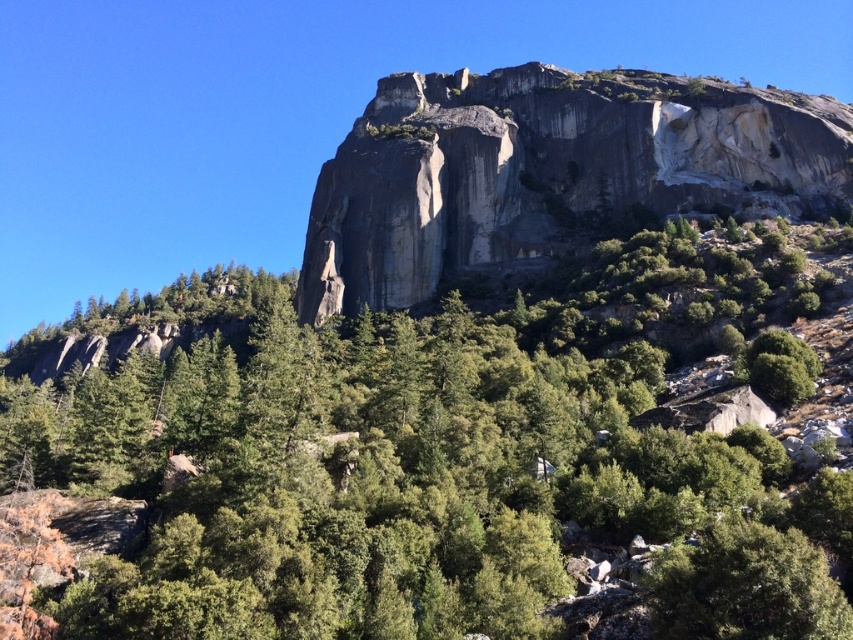
Does green leafy tree at center appear on the left side of gray rock formation at upper center?

Indeed, green leafy tree at center is positioned on the left side of gray rock formation at upper center.

In the scene shown: Can you confirm if green leafy tree at center is taller than gray rock formation at upper center?

No, green leafy tree at center is not taller than gray rock formation at upper center.

Between point (457, 454) and point (463, 257), which one is positioned behind?

Point (463, 257)

Find the location of a particular element. The height and width of the screenshot is (640, 853). green leafy tree at center is located at coordinates (432, 465).